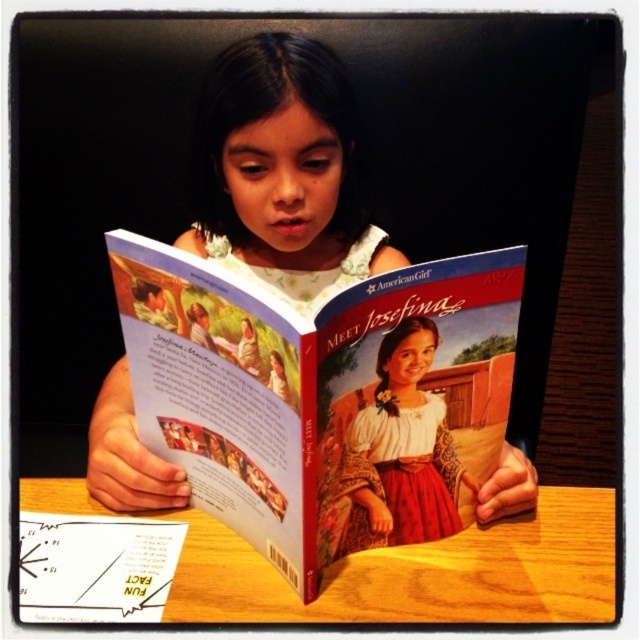
In the scene shown: You are a bookshelf designer and need to place the matte paper book at center onto a shelf that is the same height as the wooden table at center. Will the book fit vertically on the shelf?

The matte paper book at center is much taller than the wooden table at center. Since the shelf is the same height as the table, the book will not fit vertically on the shelf because it exceeds the shelf height.